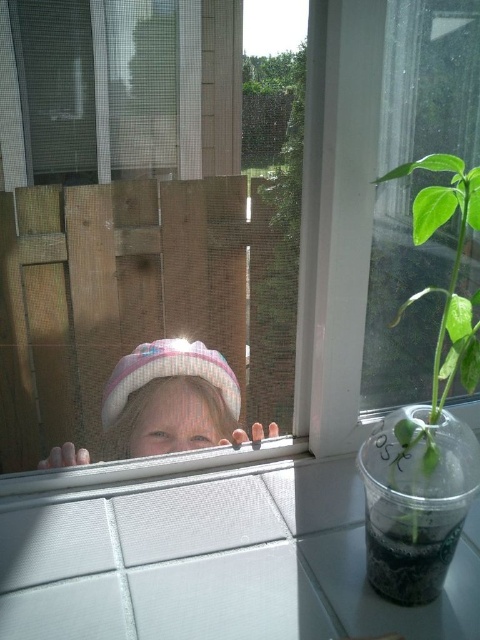
Question: Is pink woolen hat at center to the left of green leafy plant at right from the viewer's perspective?

Choices:
 (A) no
 (B) yes

Answer: (B)

Question: Is pink woolen hat at center thinner than green leafy plant at right?

Choices:
 (A) no
 (B) yes

Answer: (A)

Question: Does pink woolen hat at center appear on the right side of green leafy plant at right?

Choices:
 (A) yes
 (B) no

Answer: (B)

Question: Which point is closer to the camera?

Choices:
 (A) (456, 337)
 (B) (119, 401)

Answer: (A)

Question: Which of the following is the farthest from the observer?

Choices:
 (A) green leafy plant at right
 (B) pink woolen hat at center

Answer: (B)

Question: Which of the following is the farthest from the observer?

Choices:
 (A) (419, 420)
 (B) (219, 385)

Answer: (B)